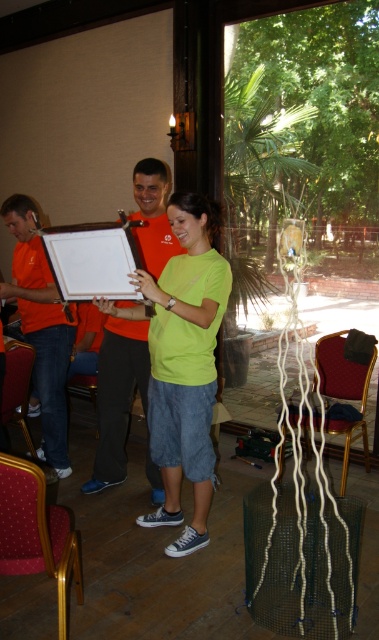
Question: Can you confirm if white cardboard at center is wider than dark brown wooden chair at lower left?

Choices:
 (A) yes
 (B) no

Answer: (A)

Question: Does gold metallic chair at lower left have a larger size compared to velvet red chair at lower right?

Choices:
 (A) yes
 (B) no

Answer: (B)

Question: Which point appears farthest from the camera in this image?

Choices:
 (A) (336, 352)
 (B) (150, 385)
 (C) (86, 385)
 (D) (51, 548)

Answer: (C)

Question: Which of the following is the farthest from the observer?

Choices:
 (A) (42, 512)
 (B) (15, 406)

Answer: (B)

Question: Does green matte shirt at center lie behind dark brown wooden chair at lower left?

Choices:
 (A) no
 (B) yes

Answer: (A)

Question: Which of the following is the closest to the observer?

Choices:
 (A) (87, 385)
 (B) (39, 476)
 (C) (347, 376)

Answer: (B)